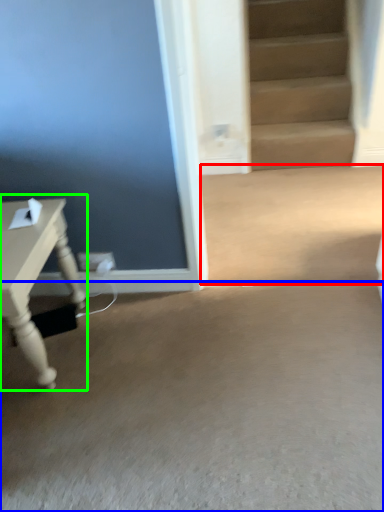
Question: Estimate the real-world distances between objects in this image. Which object is closer to concrete (highlighted by a red box), concrete (highlighted by a blue box) or table (highlighted by a green box)?

Choices:
 (A) concrete
 (B) table

Answer: (A)